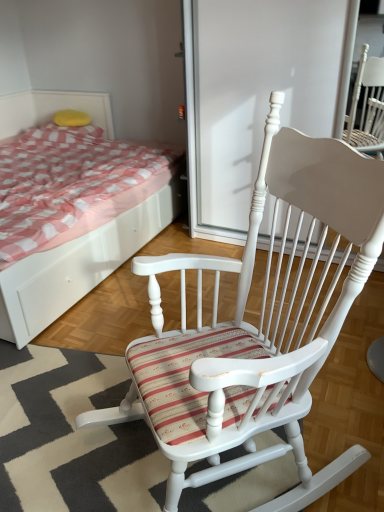
Question: In terms of width, does white wood rocking chair at center look wider or thinner when compared to yellow sponge at upper left?

Choices:
 (A) thin
 (B) wide

Answer: (B)

Question: Is white wood rocking chair at center bigger or smaller than yellow sponge at upper left?

Choices:
 (A) small
 (B) big

Answer: (B)

Question: Which object is positioned closest to the yellow sponge at upper left?

Choices:
 (A) white wood bed at upper left
 (B) white wood rocking chair at center
 (C) white wood screen door at center

Answer: (A)

Question: Estimate the real-world distances between objects in this image. Which object is farther from the yellow sponge at upper left?

Choices:
 (A) white wood screen door at center
 (B) white wood rocking chair at center
 (C) white wood bed at upper left

Answer: (B)